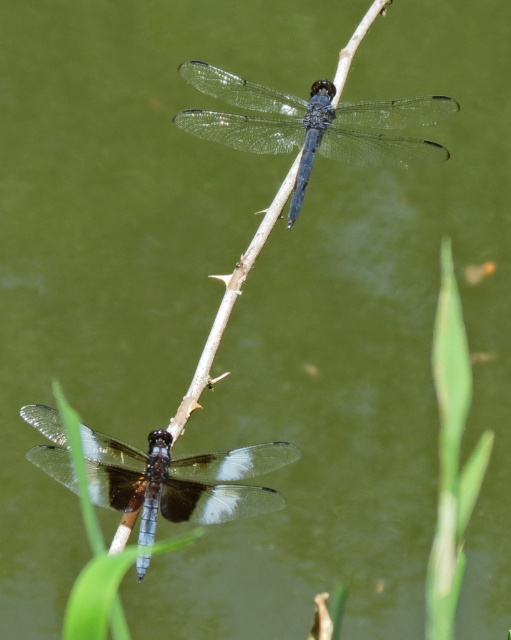
Question: Can you confirm if transparent glass dragonfly at upper center is thinner than translucent glass dragonfly at lower center?

Choices:
 (A) yes
 (B) no

Answer: (B)

Question: Is transparent glass dragonfly at upper center above translucent glass dragonfly at lower center?

Choices:
 (A) no
 (B) yes

Answer: (B)

Question: Among these points, which one is nearest to the camera?

Choices:
 (A) (397, 160)
 (B) (195, 509)

Answer: (B)

Question: Which of the following is the farthest from the observer?

Choices:
 (A) (375, 113)
 (B) (100, 497)

Answer: (A)

Question: Can you confirm if transparent glass dragonfly at upper center is positioned above translucent glass dragonfly at lower center?

Choices:
 (A) no
 (B) yes

Answer: (B)

Question: Which point is closer to the camera?

Choices:
 (A) transparent glass dragonfly at upper center
 (B) translucent glass dragonfly at lower center

Answer: (B)